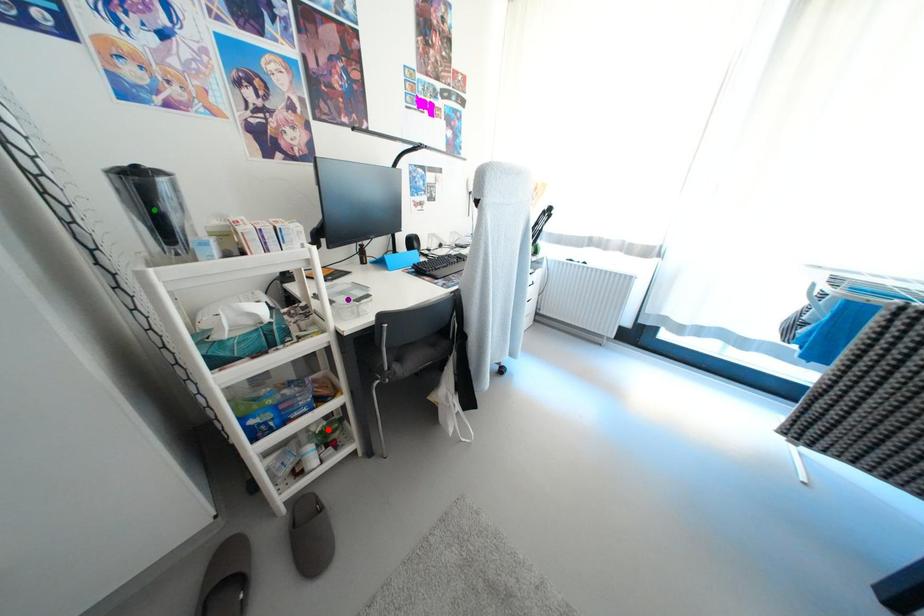
Order these from nearest to farthest:
red point | green point | purple point

1. red point
2. purple point
3. green point